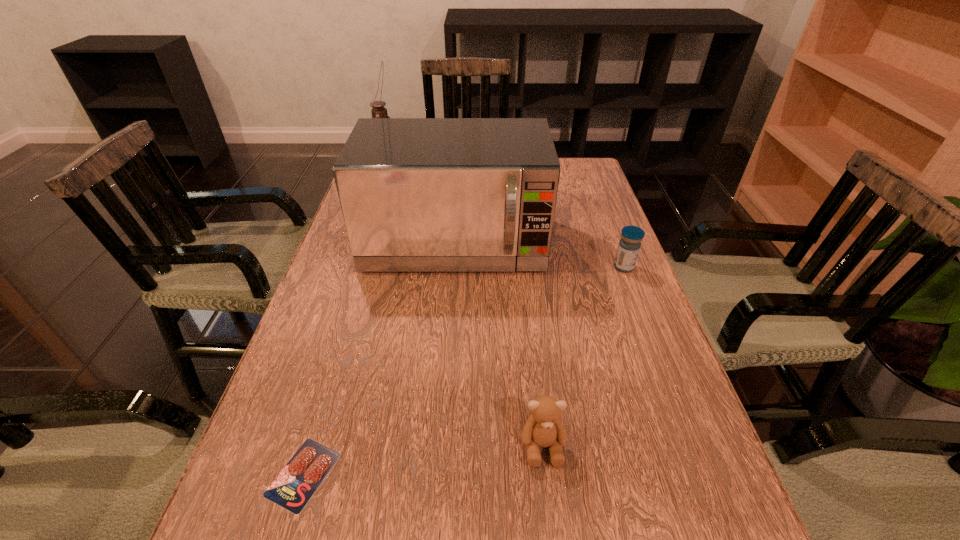
This screenshot has height=540, width=960. Identify the location of vacant area that lies between the teddy bear and the farthest object. (465, 307).

The image size is (960, 540). I want to click on free space between the medicine and the teddy bear, so point(584,356).

Find the location of a particular element. blank region between the teddy bear and the shortest object is located at coordinates (423, 460).

Identify the location of vacant area that lies between the teddy bear and the shortest object. This screenshot has width=960, height=540. (423, 460).

Locate an element on the screen. Image resolution: width=960 pixels, height=540 pixels. free spot between the shortest object and the farthest object is located at coordinates (346, 321).

This screenshot has height=540, width=960. Find the location of `vacant area between the tallest object and the salami`. vacant area between the tallest object and the salami is located at coordinates (346, 321).

Image resolution: width=960 pixels, height=540 pixels. I want to click on free space between the medicine and the salami, so click(464, 370).

Find the location of a particular element. Image resolution: width=960 pixels, height=540 pixels. free point between the fourth shortest object and the shortest object is located at coordinates (379, 360).

The width and height of the screenshot is (960, 540). Find the location of `free area in between the salami and the farthest object`. free area in between the salami and the farthest object is located at coordinates (x=346, y=321).

The height and width of the screenshot is (540, 960). Find the location of `object that is the fourth closest to the salami`. object that is the fourth closest to the salami is located at coordinates (378, 111).